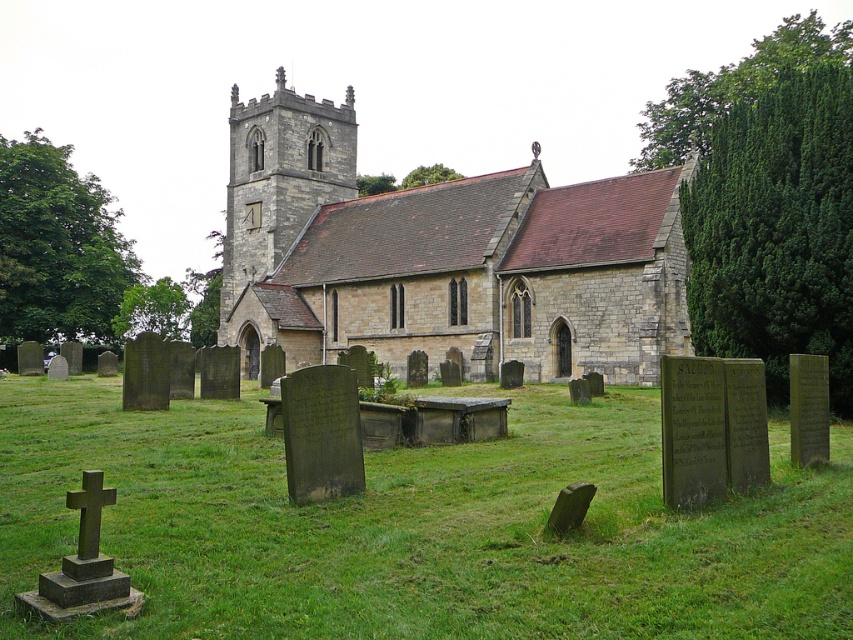
You are a visitor standing in the churchyard. You notice the green grass at center and the stone church at center. Which object is taller?

The stone church at center is taller than the green grass at center.

You are standing in the churchyard and want to take a photo of both point (209,419) and point (405,192). Which point should you focus on first to ensure both are in clear view?

You should focus on point (209,419) first because it is closer to the camera than point (405,192), ensuring both are in focus.